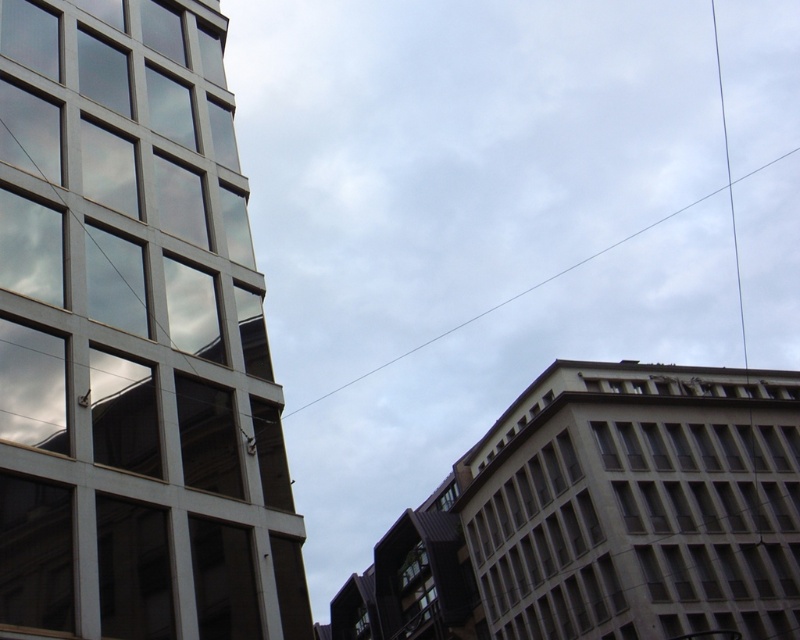
Does matte glass building at left have a lesser height compared to transparent glass window at upper left?

Incorrect, matte glass building at left's height does not fall short of transparent glass window at upper left's.

Who is positioned more to the left, matte glass building at left or transparent glass window at upper left?

From the viewer's perspective, transparent glass window at upper left appears more on the left side.

Who is more forward, (100, 540) or (84, 33)?

Positioned in front is point (100, 540).

This screenshot has width=800, height=640. What are the coordinates of `matte glass building at left` in the screenshot? It's located at (134, 342).

Is point (224, 428) more distant than point (405, 556)?

No, (224, 428) is closer to viewer.

Between matte glass building at left and clear glass window at lower center, which one is positioned higher?

matte glass building at left

Find the location of a particular element. This screenshot has width=800, height=640. matte glass building at left is located at coordinates (134, 342).

Does white wire at upper center have a lesser height compared to clear glass window at lower center?

No.

You are a GUI agent. You are given a task and a screenshot of the screen. Output one action in this format:
    pyautogui.click(x=<x>, y=<y>)
    Task: Click on the white wire at upper center
    The height and width of the screenshot is (640, 800).
    Given the screenshot: What is the action you would take?
    pyautogui.click(x=544, y=282)